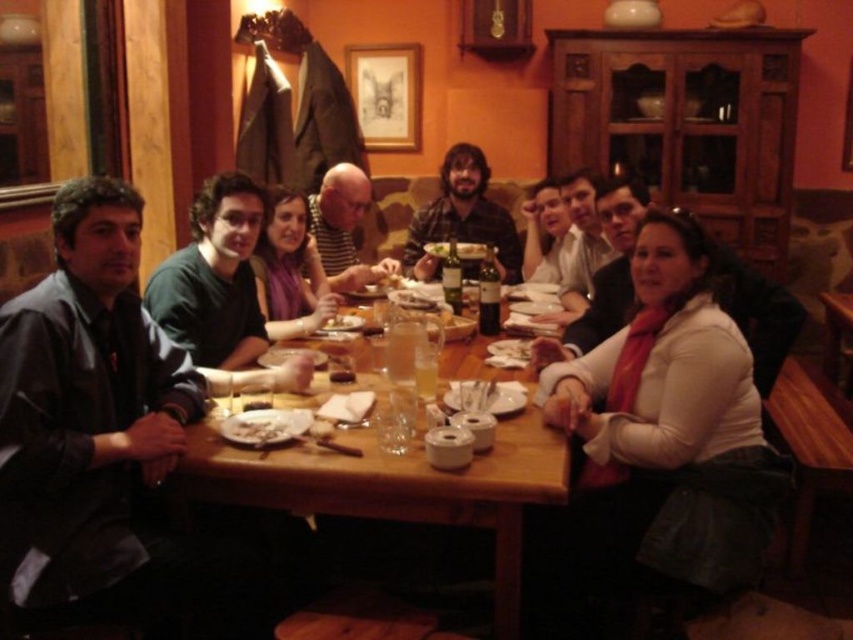
Can you confirm if black matte shirt at left is shorter than dark green shirt at center?

No, black matte shirt at left is not shorter than dark green shirt at center.

Who is more distant from viewer, (19, 470) or (299, 355)?

The point (299, 355) is more distant.

Identify the location of black matte shirt at left. Image resolution: width=853 pixels, height=640 pixels. (86, 413).

Based on the photo, who is positioned more to the left, matte purple scarf at center or white scarf at center?

From the viewer's perspective, matte purple scarf at center appears more on the left side.

Is point (317, 296) positioned before point (587, 243)?

That is True.

You are a GUI agent. You are given a task and a screenshot of the screen. Output one action in this format:
    pyautogui.click(x=<x>, y=<y>)
    Task: Click on the matte purple scarf at center
    The width and height of the screenshot is (853, 640).
    Given the screenshot: What is the action you would take?
    pyautogui.click(x=289, y=269)

Does white matte scarf at right have a greater width compared to matte purple scarf at center?

Indeed, white matte scarf at right has a greater width compared to matte purple scarf at center.

Is point (581, 378) more distant than point (292, 216)?

No, (581, 378) is in front of (292, 216).

Where is `white matte scarf at right`? white matte scarf at right is located at coordinates (654, 435).